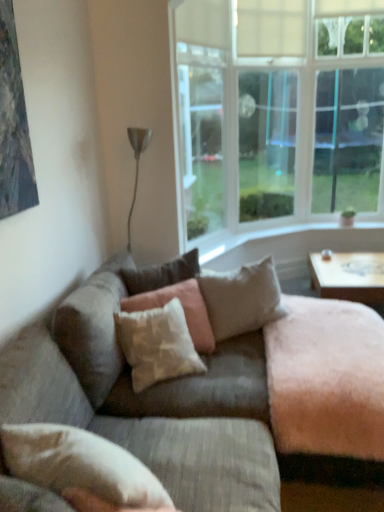
The height and width of the screenshot is (512, 384). In order to click on transparent plastic window screen at upper center, positioned as the 3th window screen in right-to-left order in this screenshot , I will do `click(201, 136)`.

Measure the distance between point (244,138) and camera.

They are 4.64 meters apart.

What is the approximate height of textured beige pillow at center, the second pillow from the front?

15.28 inches.

What do you see at coordinates (80, 464) in the screenshot? I see `white fabric pillow at lower left, the fourth pillow in the back-to-front sequence` at bounding box center [80, 464].

In order to face beige textured pillow at center, the fourth pillow in the front-to-back sequence, should I rotate leftwards or rightwards?

To face it directly, rotate left by 3.559 degrees.

What do you see at coordinates (161, 274) in the screenshot? I see `beige textured pillow at center, the fourth pillow in the front-to-back sequence` at bounding box center [161, 274].

Image resolution: width=384 pixels, height=512 pixels. What do you see at coordinates (349, 276) in the screenshot?
I see `wooden coffee table at right` at bounding box center [349, 276].

In order to click on light beige fabric pillow at center, marked as the 3th pillow in a front-to-back arrangement in this screenshot , I will do `click(241, 298)`.

What are the coordinates of `transparent plastic window screen at upper center, which ranks as the 1th window screen in left-to-right order` in the screenshot? It's located at (201, 136).

Which of these two, textured beige couch at center or transparent glass window at center, the 2th window screen when ordered from left to right, is thinner?

Thinner between the two is transparent glass window at center, the 2th window screen when ordered from left to right.

From the image's perspective, does textured beige couch at center appear lower than transparent glass window at center, which is counted as the 2th window screen, starting from the right?

Yes.

Is textured beige couch at center to the left of transparent glass window at center, which is counted as the 2th window screen, starting from the right, from the viewer's perspective?

Indeed, textured beige couch at center is positioned on the left side of transparent glass window at center, which is counted as the 2th window screen, starting from the right.

Does textured beige couch at center touch transparent glass window at center, the 2th window screen when ordered from left to right?

There is a gap between textured beige couch at center and transparent glass window at center, the 2th window screen when ordered from left to right.

Is the depth of wooden coffee table at right greater than that of textured beige pillow at center, the third pillow in the back-to-front sequence?

Yes, wooden coffee table at right is further from the viewer.

Based on the photo, considering the positions of objects wooden coffee table at right and textured beige pillow at center, the third pillow in the back-to-front sequence, in the image provided, who is more to the left, wooden coffee table at right or textured beige pillow at center, the third pillow in the back-to-front sequence,?

Positioned to the left is textured beige pillow at center, the third pillow in the back-to-front sequence.

Is wooden coffee table at right not close to textured beige pillow at center, the second pillow from the front?

Absolutely, wooden coffee table at right is distant from textured beige pillow at center, the second pillow from the front.

From their relative heights in the image, would you say wooden coffee table at right is taller or shorter than textured beige pillow at center, the third pillow in the back-to-front sequence?

In the image, wooden coffee table at right appears to be shorter than textured beige pillow at center, the third pillow in the back-to-front sequence.

Is clear glass window at upper right, marked as the first window screen in a right-to-left arrangement, at the right side of white fabric pillow at lower left, the fourth pillow in the back-to-front sequence?

Yes, clear glass window at upper right, marked as the first window screen in a right-to-left arrangement, is to the right of white fabric pillow at lower left, the fourth pillow in the back-to-front sequence.

Does clear glass window at upper right, which is the third window screen from left to right, contain white fabric pillow at lower left, the first pillow in the front-to-back sequence?

No, white fabric pillow at lower left, the first pillow in the front-to-back sequence, is not a part of clear glass window at upper right, which is the third window screen from left to right.

Who is shorter, clear glass window at upper right, which is the third window screen from left to right, or white fabric pillow at lower left, the first pillow in the front-to-back sequence?

Standing shorter between the two is white fabric pillow at lower left, the first pillow in the front-to-back sequence.

Is wooden coffee table at right taller or shorter than white fabric pillow at lower left, the fourth pillow in the back-to-front sequence?

Clearly, wooden coffee table at right is taller compared to white fabric pillow at lower left, the fourth pillow in the back-to-front sequence.

From the image's perspective, which pillow is the 2nd one below the wooden coffee table at right? Please provide its 2D coordinates.

[(80, 464)]

Considering the positions of objects wooden coffee table at right and white fabric pillow at lower left, the fourth pillow in the back-to-front sequence, in the image provided, who is in front, wooden coffee table at right or white fabric pillow at lower left, the fourth pillow in the back-to-front sequence,?

Positioned in front is white fabric pillow at lower left, the fourth pillow in the back-to-front sequence.

In the scene shown: What's the angular difference between wooden coffee table at right and white fabric pillow at lower left, the first pillow in the front-to-back sequence,'s facing directions?

The facing directions of wooden coffee table at right and white fabric pillow at lower left, the first pillow in the front-to-back sequence, are 63.2 degrees apart.

From the picture: From the image's perspective, between beige textured pillow at center, the fourth pillow in the front-to-back sequence, and wooden coffee table at right, which one is located above?

beige textured pillow at center, the fourth pillow in the front-to-back sequence, appears higher in the image.

From a real-world perspective, relative to wooden coffee table at right, is beige textured pillow at center, the fourth pillow in the front-to-back sequence, vertically above or below?

From a real-world perspective, beige textured pillow at center, the fourth pillow in the front-to-back sequence, is physically above wooden coffee table at right.

Is beige textured pillow at center, the fourth pillow in the front-to-back sequence, positioned with its back to wooden coffee table at right?

No, beige textured pillow at center, the fourth pillow in the front-to-back sequence, is not facing the opposite direction of wooden coffee table at right.

Is beige textured pillow at center, which is counted as the first pillow, starting from the back, next to wooden coffee table at right?

There is a gap between beige textured pillow at center, which is counted as the first pillow, starting from the back, and wooden coffee table at right.

Looking at this image, does textured beige couch at center turn towards transparent plastic window screen at upper center, which ranks as the 1th window screen in left-to-right order?

No, textured beige couch at center is not oriented towards transparent plastic window screen at upper center, which ranks as the 1th window screen in left-to-right order.

From a real-world perspective, who is located higher, textured beige couch at center or transparent plastic window screen at upper center, which ranks as the 1th window screen in left-to-right order?

transparent plastic window screen at upper center, which ranks as the 1th window screen in left-to-right order.

Is textured beige couch at center not close to transparent plastic window screen at upper center, positioned as the 3th window screen in right-to-left order?

Yes, textured beige couch at center and transparent plastic window screen at upper center, positioned as the 3th window screen in right-to-left order, are quite far apart.

In the image, is textured beige couch at center on the left side or the right side of transparent plastic window screen at upper center, which ranks as the 1th window screen in left-to-right order?

textured beige couch at center is to the left of transparent plastic window screen at upper center, which ranks as the 1th window screen in left-to-right order.

From a real-world perspective, is textured beige couch at center beneath wooden coffee table at right?

No, from a real-world perspective, textured beige couch at center is not beneath wooden coffee table at right.

Between textured beige couch at center and wooden coffee table at right, which one has larger size?

With larger size is textured beige couch at center.

Can you tell me how much textured beige couch at center and wooden coffee table at right differ in facing direction?

The angle between the facing direction of textured beige couch at center and the facing direction of wooden coffee table at right is 90.7 degrees.

Locate an element on the screen. The image size is (384, 512). studio couch beneath the transparent glass window at center, which is counted as the 2th window screen, starting from the right (from a real-world perspective) is located at coordinates (185, 415).

The height and width of the screenshot is (512, 384). What are the coordinates of `the 3rd pillow in front of the wooden coffee table at right` in the screenshot? It's located at (182, 307).

Estimate the real-world distances between objects in this image. Which object is further from transparent plastic window screen at upper center, which ranks as the 1th window screen in left-to-right order, light beige fabric pillow at center, marked as the 3th pillow in a front-to-back arrangement, or white fabric pillow at lower left, the fourth pillow in the back-to-front sequence?

Based on the image, white fabric pillow at lower left, the fourth pillow in the back-to-front sequence, appears to be further to transparent plastic window screen at upper center, which ranks as the 1th window screen in left-to-right order.

Considering their positions, is textured beige pillow at center, the third pillow in the back-to-front sequence, positioned further to transparent glass window at center, the 2th window screen when ordered from left to right, than light beige fabric pillow at center, the 2th pillow viewed from the back?

The object further to transparent glass window at center, the 2th window screen when ordered from left to right, is textured beige pillow at center, the third pillow in the back-to-front sequence.

Based on their spatial positions, is textured beige couch at center or transparent glass window at center, the 2th window screen when ordered from left to right, further from clear glass window at upper right, marked as the first window screen in a right-to-left arrangement?

textured beige couch at center.

From the image, which object appears to be farther from beige textured pillow at center, the fourth pillow in the front-to-back sequence, transparent plastic window screen at upper center, positioned as the 3th window screen in right-to-left order, or white fabric pillow at lower left, the first pillow in the front-to-back sequence?

transparent plastic window screen at upper center, positioned as the 3th window screen in right-to-left order, is further to beige textured pillow at center, the fourth pillow in the front-to-back sequence.

Estimate the real-world distances between objects in this image. Which object is closer to wooden coffee table at right, clear glass window at upper right, marked as the first window screen in a right-to-left arrangement, or textured beige couch at center?

The object closer to wooden coffee table at right is clear glass window at upper right, marked as the first window screen in a right-to-left arrangement.

Considering their positions, is beige textured pillow at center, which is counted as the first pillow, starting from the back, positioned further to transparent plastic window screen at upper center, positioned as the 3th window screen in right-to-left order, than light beige fabric pillow at center, marked as the 3th pillow in a front-to-back arrangement?

light beige fabric pillow at center, marked as the 3th pillow in a front-to-back arrangement, lies further to transparent plastic window screen at upper center, positioned as the 3th window screen in right-to-left order, than the other object.

Estimate the real-world distances between objects in this image. Which object is further from wooden coffee table at right, textured beige couch at center or beige textured pillow at center, which is counted as the first pillow, starting from the back?

textured beige couch at center lies further to wooden coffee table at right than the other object.

Based on the photo, which object lies further to the anchor point textured beige pillow at center, the second pillow from the front, white fabric pillow at lower left, the fourth pillow in the back-to-front sequence, or wooden coffee table at right?

wooden coffee table at right is positioned further to the anchor textured beige pillow at center, the second pillow from the front.

At what (x,y) coordinates should I click in order to perform the action: click on window screen between white fabric pillow at lower left, the fourth pillow in the back-to-front sequence, and transparent glass window at center, the 2th window screen when ordered from left to right, from front to back. Please return your answer as a coordinate pair (x, y). The width and height of the screenshot is (384, 512). Looking at the image, I should click on (201, 136).

At what (x,y) coordinates should I click in order to perform the action: click on pillow between transparent glass window at center, the 2th window screen when ordered from left to right, and light beige fabric pillow at center, the 2th pillow viewed from the back, in the vertical direction. Please return your answer as a coordinate pair (x, y). Image resolution: width=384 pixels, height=512 pixels. Looking at the image, I should click on (161, 274).

At what (x,y) coordinates should I click in order to perform the action: click on window screen between transparent glass window at center, which is counted as the 2th window screen, starting from the right, and light beige fabric pillow at center, marked as the 3th pillow in a front-to-back arrangement, in the vertical direction. Please return your answer as a coordinate pair (x, y). Looking at the image, I should click on (201, 136).

This screenshot has width=384, height=512. Find the location of `pillow between beige textured pillow at center, which is counted as the first pillow, starting from the back, and light beige fabric pillow at center, the 2th pillow viewed from the back, in the horizontal direction`. pillow between beige textured pillow at center, which is counted as the first pillow, starting from the back, and light beige fabric pillow at center, the 2th pillow viewed from the back, in the horizontal direction is located at coordinates (182, 307).